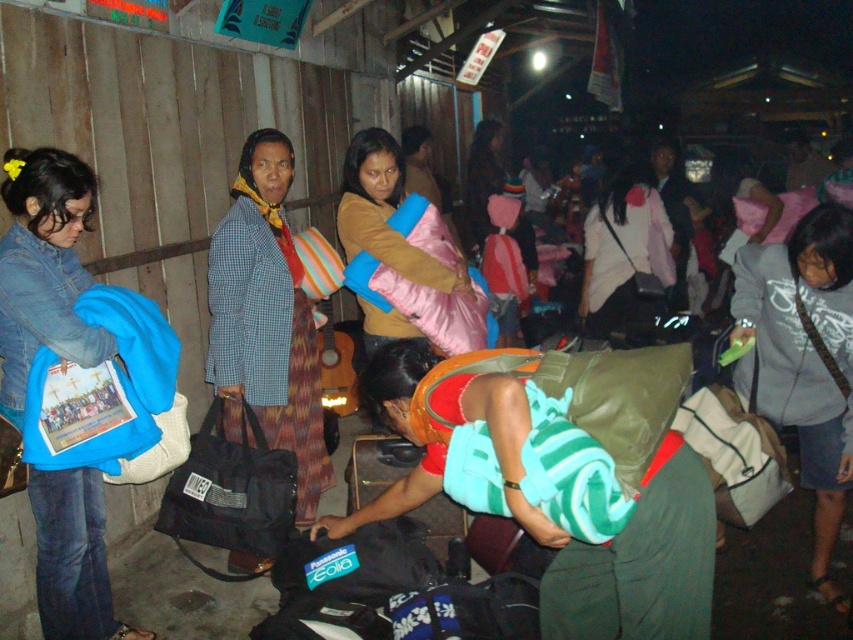
You are navigating through a crowded transit hub at night. You need to reach a specific location marked by point (314, 496). There is an obstacle at point (264, 529). Can you go around the obstacle to reach your destination?

Point (314, 496) is behind point (264, 529), so you can go around the obstacle at point (264, 529) to reach your destination at point (314, 496).